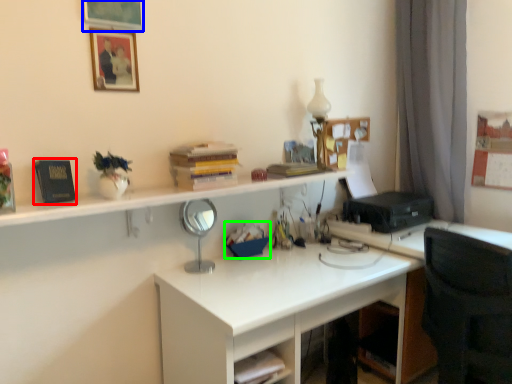
Question: Estimate the real-world distances between objects in this image. Which object is closer to book (highlighted by a red box), picture frame (highlighted by a blue box) or stationery (highlighted by a green box)?

Choices:
 (A) picture frame
 (B) stationery

Answer: (A)